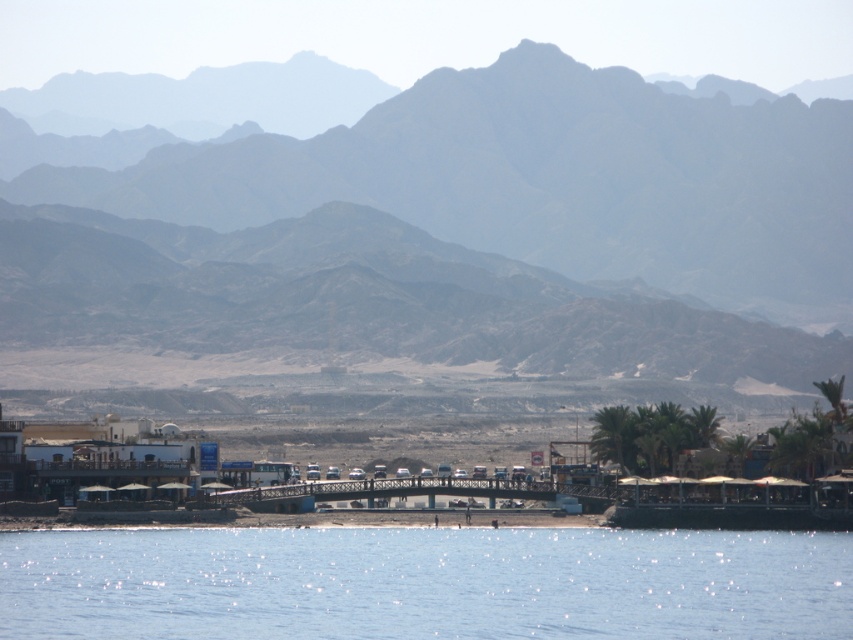
Question: Can you confirm if rocky gray mountains at upper center is thinner than white plastic boat at lower right?

Choices:
 (A) yes
 (B) no

Answer: (B)

Question: Which of the following is the farthest from the observer?

Choices:
 (A) (38, 237)
 (B) (631, 541)

Answer: (A)

Question: Does rocky gray mountains at upper center have a larger size compared to transparent blue water at lower center?

Choices:
 (A) no
 (B) yes

Answer: (B)

Question: From the image, what is the correct spatial relationship of rocky gray mountains at upper center in relation to white plastic boat at lower right?

Choices:
 (A) above
 (B) below

Answer: (A)

Question: Which of the following is the farthest from the observer?

Choices:
 (A) (537, 58)
 (B) (302, 611)

Answer: (A)

Question: Which of the following is the farthest from the observer?

Choices:
 (A) transparent blue water at lower center
 (B) white plastic boat at lower right
 (C) rocky gray mountains at upper center

Answer: (C)